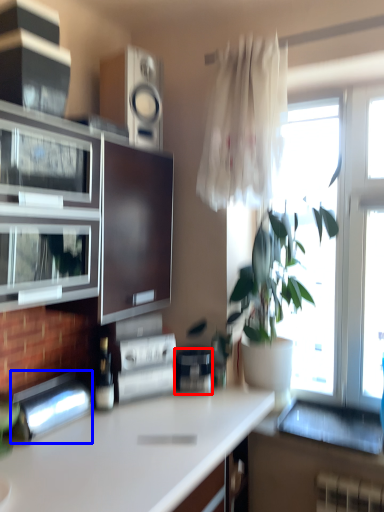
Question: Among these objects, which one is farthest to the camera, appliance (highlighted by a red box) or appliance (highlighted by a blue box)?

Choices:
 (A) appliance
 (B) appliance

Answer: (A)